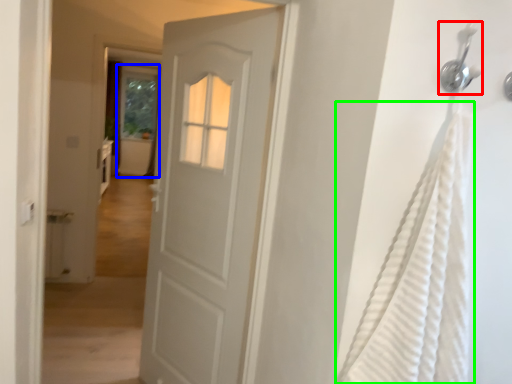
Question: Based on their relative distances, which object is farther from shower (highlighted by a red box)? Choose from screen door (highlighted by a blue box) and shower curtain (highlighted by a green box).

Choices:
 (A) screen door
 (B) shower curtain

Answer: (A)